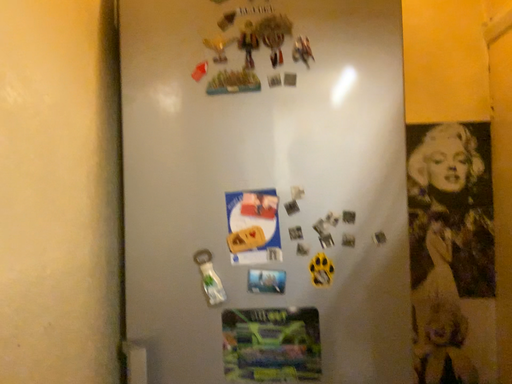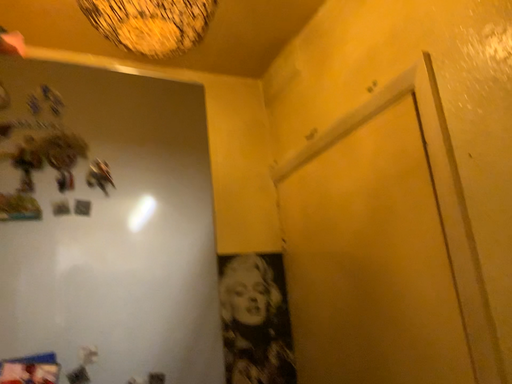
Question: How did the camera likely rotate when shooting the video?

Choices:
 (A) rotated left
 (B) rotated right

Answer: (B)